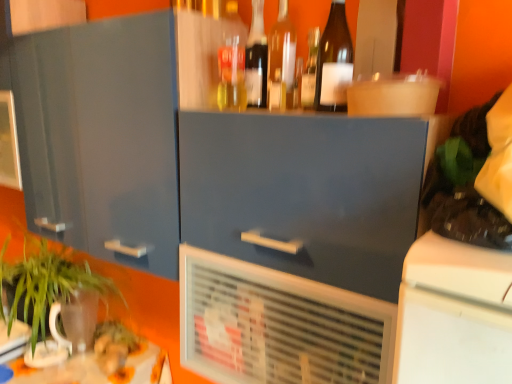
How much space does translucent plastic bottle at upper center, the 1th bottle positioned from the left, occupy horizontally?

It is 3.41 inches.

Measure the distance between point (x=229, y=1) and camera.

1.21 meters.

Locate an element on the screen. The height and width of the screenshot is (384, 512). glossy blue cabinet at upper center, placed as the first cabinetry when sorted from left to right is located at coordinates (102, 137).

Locate an element on the screen. Image resolution: width=512 pixels, height=384 pixels. brown glass bottle at upper center, the 1th bottle in the right-to-left sequence is located at coordinates (334, 61).

Measure the distance between transparent glass bottle at upper center, marked as the third bottle in a left-to-right arrangement, and camera.

transparent glass bottle at upper center, marked as the third bottle in a left-to-right arrangement, is 3.49 feet away from camera.

This screenshot has height=384, width=512. Describe the element at coordinates (305, 193) in the screenshot. I see `matte gray cabinet at center, acting as the second cabinetry starting from the left` at that location.

Where is `translucent plastic bottle at upper center, the 1th bottle positioned from the left`? The image size is (512, 384). translucent plastic bottle at upper center, the 1th bottle positioned from the left is located at coordinates (232, 61).

Is green leafy plant at lower left turned away from matte gray cabinet at center, acting as the second cabinetry starting from the left?

That's not correct — green leafy plant at lower left is not looking away from matte gray cabinet at center, acting as the second cabinetry starting from the left.

Is green leafy plant at lower left wider than matte gray cabinet at center, the 1th cabinetry in the right-to-left sequence?

Yes.

Is green leafy plant at lower left bigger or smaller than matte gray cabinet at center, the 1th cabinetry in the right-to-left sequence?

In the image, green leafy plant at lower left appears to be larger than matte gray cabinet at center, the 1th cabinetry in the right-to-left sequence.

Find the location of a particular element. houseplant to the left of matte gray cabinet at center, acting as the second cabinetry starting from the left is located at coordinates (46, 287).

Considering the sizes of translucent glass bottle at upper center, the 4th bottle viewed from the right, and white plastic air conditioning unit at center in the image, is translucent glass bottle at upper center, the 4th bottle viewed from the right, wider or thinner than white plastic air conditioning unit at center?

Clearly, translucent glass bottle at upper center, the 4th bottle viewed from the right, has less width compared to white plastic air conditioning unit at center.

How different are the orientations of translucent glass bottle at upper center, the 4th bottle viewed from the right, and white plastic air conditioning unit at center in degrees?

translucent glass bottle at upper center, the 4th bottle viewed from the right, and white plastic air conditioning unit at center are facing 6.81 degrees away from each other.

Is translucent glass bottle at upper center, the 4th bottle viewed from the right, looking in the opposite direction of white plastic air conditioning unit at center?

No.

Measure the distance from translucent glass bottle at upper center, which ranks as the second bottle in left-to-right order, to white plastic air conditioning unit at center.

translucent glass bottle at upper center, which ranks as the second bottle in left-to-right order, is 22.36 inches away from white plastic air conditioning unit at center.

From their relative heights in the image, would you say glossy blue cabinet at upper center, placed as the first cabinetry when sorted from left to right, is taller or shorter than translucent plastic bottle at upper center, which is the fifth bottle in right-to-left order?

Clearly, glossy blue cabinet at upper center, placed as the first cabinetry when sorted from left to right, is taller compared to translucent plastic bottle at upper center, which is the fifth bottle in right-to-left order.

Is glossy blue cabinet at upper center, the 2th cabinetry from the right, smaller than translucent plastic bottle at upper center, which is the fifth bottle in right-to-left order?

No, glossy blue cabinet at upper center, the 2th cabinetry from the right, is not smaller than translucent plastic bottle at upper center, which is the fifth bottle in right-to-left order.

What's the angular difference between glossy blue cabinet at upper center, placed as the first cabinetry when sorted from left to right, and translucent plastic bottle at upper center, which is the fifth bottle in right-to-left order,'s facing directions?

9.35 degrees.

From a real-world perspective, is glossy blue cabinet at upper center, the 2th cabinetry from the right, positioned above or below translucent plastic bottle at upper center, the 1th bottle positioned from the left?

In terms of real-world spatial position, glossy blue cabinet at upper center, the 2th cabinetry from the right, is below translucent plastic bottle at upper center, the 1th bottle positioned from the left.

Consider the image. Is translucent glass bottle at upper center, the 4th bottle viewed from the right, situated inside matte gray cabinet at center, the 1th cabinetry in the right-to-left sequence, or outside?

translucent glass bottle at upper center, the 4th bottle viewed from the right, is not enclosed by matte gray cabinet at center, the 1th cabinetry in the right-to-left sequence.

From a real-world perspective, is translucent glass bottle at upper center, which ranks as the second bottle in left-to-right order, located beneath matte gray cabinet at center, acting as the second cabinetry starting from the left?

Actually, translucent glass bottle at upper center, which ranks as the second bottle in left-to-right order, is physically above matte gray cabinet at center, acting as the second cabinetry starting from the left, in the real world.

There is a matte gray cabinet at center, the 1th cabinetry in the right-to-left sequence. At what (x,y) coordinates should I click in order to perform the action: click on the 5th bottle above it (from a real-world perspective). Please return your answer as a coordinate pair (x, y). This screenshot has height=384, width=512. Looking at the image, I should click on (256, 59).

Is translucent glass bottle at upper center, the 4th bottle viewed from the right, facing away from matte gray cabinet at center, the 1th cabinetry in the right-to-left sequence?

No, matte gray cabinet at center, the 1th cabinetry in the right-to-left sequence, is not at the back of translucent glass bottle at upper center, the 4th bottle viewed from the right.

Is translucent plastic bottle at upper center, which is the fifth bottle in right-to-left order, at the right side of glossy blue cabinet at upper center, placed as the first cabinetry when sorted from left to right?

Indeed, translucent plastic bottle at upper center, which is the fifth bottle in right-to-left order, is positioned on the right side of glossy blue cabinet at upper center, placed as the first cabinetry when sorted from left to right.

What's the angular difference between translucent plastic bottle at upper center, which is the fifth bottle in right-to-left order, and glossy blue cabinet at upper center, the 2th cabinetry from the right,'s facing directions?

The angle between the facing direction of translucent plastic bottle at upper center, which is the fifth bottle in right-to-left order, and the facing direction of glossy blue cabinet at upper center, the 2th cabinetry from the right, is 9.35 degrees.

Considering their positions, is translucent plastic bottle at upper center, the 1th bottle positioned from the left, located in front of or behind glossy blue cabinet at upper center, placed as the first cabinetry when sorted from left to right?

In the image, translucent plastic bottle at upper center, the 1th bottle positioned from the left, appears behind glossy blue cabinet at upper center, placed as the first cabinetry when sorted from left to right.

Which bottle is the 1st one when counting from the right side of the glossy blue cabinet at upper center, the 2th cabinetry from the right? Please provide its 2D coordinates.

[(232, 61)]

In the scene shown: How much distance is there between matte gray cabinet at center, acting as the second cabinetry starting from the left, and translucent plastic bottle at upper center, which is the fifth bottle in right-to-left order?

matte gray cabinet at center, acting as the second cabinetry starting from the left, is 14.10 inches away from translucent plastic bottle at upper center, which is the fifth bottle in right-to-left order.

Who is smaller, matte gray cabinet at center, acting as the second cabinetry starting from the left, or translucent plastic bottle at upper center, which is the fifth bottle in right-to-left order?

translucent plastic bottle at upper center, which is the fifth bottle in right-to-left order, is smaller.

Starting from the matte gray cabinet at center, the 1th cabinetry in the right-to-left sequence, which bottle is the 4th one behind? Please provide its 2D coordinates.

[(232, 61)]

In the scene shown: Would you say brown glass bottle at upper center, marked as the fifth bottle in a left-to-right arrangement, is outside translucent plastic bottle at upper center, which is the fifth bottle in right-to-left order?

→ That's correct, brown glass bottle at upper center, marked as the fifth bottle in a left-to-right arrangement, is outside of translucent plastic bottle at upper center, which is the fifth bottle in right-to-left order.

Is brown glass bottle at upper center, the 1th bottle in the right-to-left sequence, oriented away from translucent plastic bottle at upper center, the 1th bottle positioned from the left?

No, brown glass bottle at upper center, the 1th bottle in the right-to-left sequence, is not facing away from translucent plastic bottle at upper center, the 1th bottle positioned from the left.

From the image's perspective, which is above, brown glass bottle at upper center, the 1th bottle in the right-to-left sequence, or translucent plastic bottle at upper center, which is the fifth bottle in right-to-left order?

From the image's view, translucent plastic bottle at upper center, which is the fifth bottle in right-to-left order, is above.

From the image's perspective, starting from the brown glass bottle at upper center, the 1th bottle in the right-to-left sequence, which bottle is the 1st one above? Please provide its 2D coordinates.

[(232, 61)]

You are a GUI agent. You are given a task and a screenshot of the screen. Output one action in this format:
    pyautogui.click(x=<x>, y=<y>)
    Task: Click on the houseplant that appears below the matte gray cabinet at center, the 1th cabinetry in the right-to-left sequence (from a real-world perspective)
    This screenshot has height=384, width=512.
    Given the screenshot: What is the action you would take?
    pyautogui.click(x=46, y=287)

Where is `bottle that is the 5th one when counting backward from the white plastic air conditioning unit at center`? bottle that is the 5th one when counting backward from the white plastic air conditioning unit at center is located at coordinates (256, 59).

From the image, which object appears to be nearer to translucent glass bottle at center, arranged as the 2th bottle when viewed from the right, matte gray cabinet at center, acting as the second cabinetry starting from the left, or translucent plastic bottle at upper center, which is the fifth bottle in right-to-left order?

translucent plastic bottle at upper center, which is the fifth bottle in right-to-left order, lies closer to translucent glass bottle at center, arranged as the 2th bottle when viewed from the right, than the other object.

Estimate the real-world distances between objects in this image. Which object is further from transparent glass bottle at upper center, marked as the third bottle in a left-to-right arrangement, brown glass bottle at upper center, the 1th bottle in the right-to-left sequence, or translucent glass bottle at upper center, which ranks as the second bottle in left-to-right order?

The object further to transparent glass bottle at upper center, marked as the third bottle in a left-to-right arrangement, is brown glass bottle at upper center, the 1th bottle in the right-to-left sequence.

Looking at the image, which one is located further to translucent glass bottle at upper center, the 4th bottle viewed from the right, white plastic air conditioning unit at center or brown glass bottle at upper center, marked as the fifth bottle in a left-to-right arrangement?

white plastic air conditioning unit at center lies further to translucent glass bottle at upper center, the 4th bottle viewed from the right, than the other object.

Consider the image. When comparing their distances from matte gray cabinet at center, acting as the second cabinetry starting from the left, does translucent plastic bottle at upper center, which is the fifth bottle in right-to-left order, or white plastic air conditioning unit at center seem further?

translucent plastic bottle at upper center, which is the fifth bottle in right-to-left order, is positioned further to the anchor matte gray cabinet at center, acting as the second cabinetry starting from the left.

Which object lies further to the anchor point matte gray cabinet at center, the 1th cabinetry in the right-to-left sequence, brown glass bottle at upper center, the 1th bottle in the right-to-left sequence, or translucent plastic bottle at upper center, which is the fifth bottle in right-to-left order?

translucent plastic bottle at upper center, which is the fifth bottle in right-to-left order, lies further to matte gray cabinet at center, the 1th cabinetry in the right-to-left sequence, than the other object.

When comparing their distances from matte gray cabinet at center, the 1th cabinetry in the right-to-left sequence, does translucent glass bottle at center, arranged as the 2th bottle when viewed from the right, or transparent glass bottle at upper center, which is counted as the 3th bottle, starting from the right, seem closer?

translucent glass bottle at center, arranged as the 2th bottle when viewed from the right, is positioned closer to the anchor matte gray cabinet at center, the 1th cabinetry in the right-to-left sequence.

Considering their positions, is translucent glass bottle at upper center, which ranks as the second bottle in left-to-right order, positioned further to matte gray cabinet at center, acting as the second cabinetry starting from the left, than glossy blue cabinet at upper center, placed as the first cabinetry when sorted from left to right?

Among the two, glossy blue cabinet at upper center, placed as the first cabinetry when sorted from left to right, is located further to matte gray cabinet at center, acting as the second cabinetry starting from the left.

Based on their spatial positions, is glossy blue cabinet at upper center, placed as the first cabinetry when sorted from left to right, or translucent glass bottle at upper center, which ranks as the second bottle in left-to-right order, closer to translucent plastic bottle at upper center, the 1th bottle positioned from the left?

Based on the image, translucent glass bottle at upper center, which ranks as the second bottle in left-to-right order, appears to be nearer to translucent plastic bottle at upper center, the 1th bottle positioned from the left.

The height and width of the screenshot is (384, 512). What are the coordinates of `cabinetry between green leafy plant at lower left and translucent glass bottle at upper center, the 4th bottle viewed from the right, from left to right` in the screenshot? It's located at (102, 137).

Identify the location of cabinetry situated between green leafy plant at lower left and transparent glass bottle at upper center, which is counted as the 3th bottle, starting from the right, from left to right. (102, 137).

Where is `cabinetry between green leafy plant at lower left and matte gray cabinet at center, acting as the second cabinetry starting from the left`? cabinetry between green leafy plant at lower left and matte gray cabinet at center, acting as the second cabinetry starting from the left is located at coordinates (102, 137).

Locate an element on the screen. air conditioning between glossy blue cabinet at upper center, the 2th cabinetry from the right, and translucent glass bottle at center, arranged as the 2th bottle when viewed from the right, from left to right is located at coordinates (278, 326).